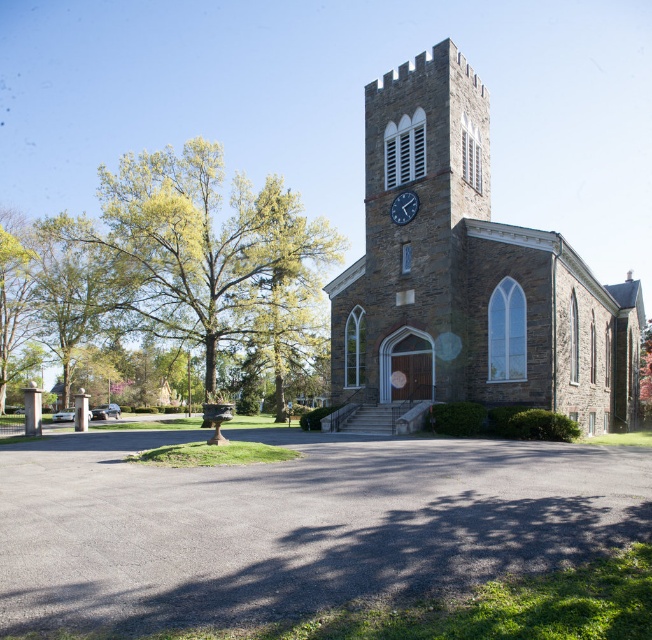
You are standing in front of the historic stone church and want to take a photo of both the green leafy tree at left and the metallic clock at upper center. Which object should you focus on first to ensure both are in the frame?

You should focus on the green leafy tree at left first because it is closer to you than the metallic clock at upper center, ensuring both are in the frame.

In the scene shown: You are standing in front of the stone church at center and want to take a photo of the metallic clock at upper center. Which object should you focus on first to ensure both are in the frame?

The stone church at center is closer to the viewer than the metallic clock at upper center. To ensure both are in the frame, focus on the stone church at center first, then adjust to include the metallic clock at upper center in the background.

You are a visitor approaching the stone church at center and the green leafy tree at left. From your perspective, which object is positioned lower in the image?

The stone church at center is positioned lower than the green leafy tree at left.